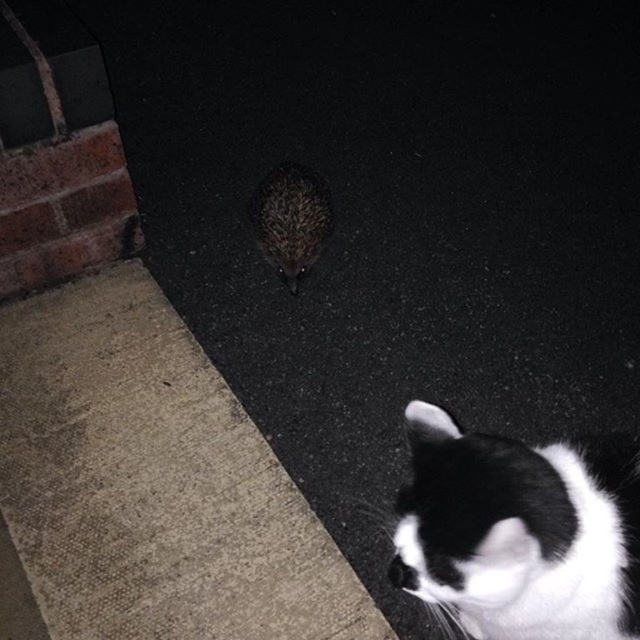
You are standing at the center of the image and want to find the black and white fur cat at lower right. Which direction should you look to locate it?

You should look to the lower right direction to find the black and white fur cat at lower right, as it is located at point (518, 531).

You are standing at the center of the image and want to walk towards the point marked at coordinates (x=518, y=531). Which animal will you encounter first, the black and white fur cat at lower right or the small animal resembling a hedgehog in the center?

The point marked at coordinates (x=518, y=531) is on the black and white fur cat at lower right, so you will encounter the black and white fur cat at lower right first.